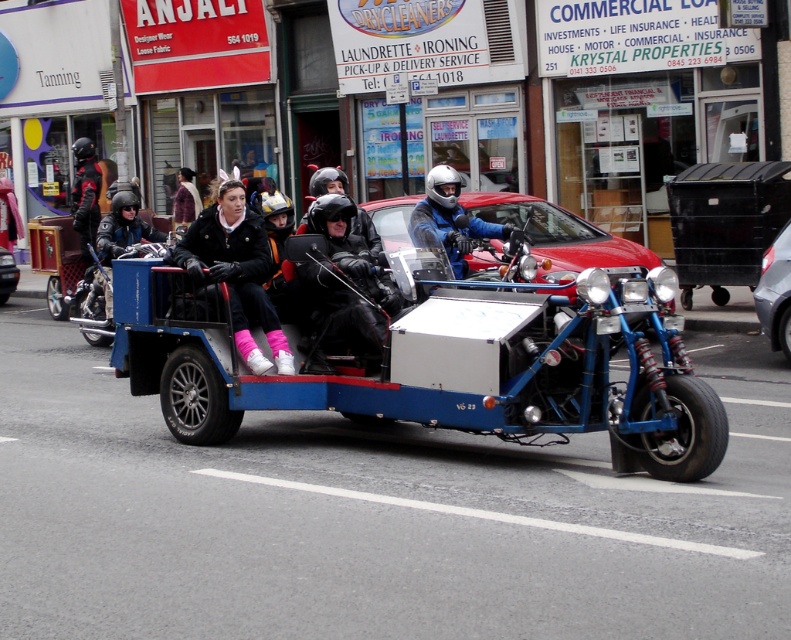
Question: Among these objects, which one is nearest to the camera?

Choices:
 (A) blue metallic sidecar at center
 (B) blue matte helmet at center
 (C) metallic gray car at right
 (D) metallic blue motorcycle at center

Answer: (A)

Question: Does pink suede boots at center have a larger size compared to shiny black helmet at left?

Choices:
 (A) no
 (B) yes

Answer: (A)

Question: Which point is closer to the camera taking this photo?

Choices:
 (A) (176, 221)
 (B) (207, 221)
 (C) (631, 305)
 (D) (89, 212)

Answer: (C)

Question: Does red matte car at center have a greater width compared to blue matte helmet at center?

Choices:
 (A) yes
 (B) no

Answer: (A)

Question: Is metallic gray car at right behind plush purple coat at center?

Choices:
 (A) yes
 (B) no

Answer: (B)

Question: Which point is farther to the camera?

Choices:
 (A) blue matte helmet at center
 (B) pink suede boots at center
 (C) shiny black helmet at left

Answer: (C)